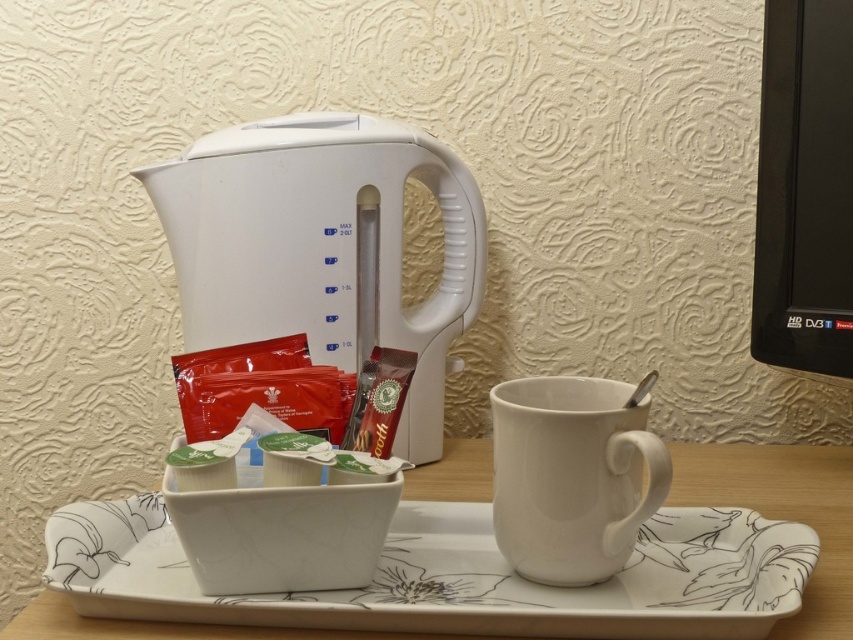
Can you confirm if black plastic monitor at upper right is positioned to the right of white ceramic mug at lower center?

Indeed, black plastic monitor at upper right is positioned on the right side of white ceramic mug at lower center.

Between black plastic monitor at upper right and white ceramic mug at lower center, which one is positioned higher?

black plastic monitor at upper right is higher up.

Find the location of a particular element. The image size is (853, 640). black plastic monitor at upper right is located at coordinates 804,189.

Who is shorter, white plastic kettle at upper center or white ceramic mug at lower center?

white ceramic mug at lower center

This screenshot has width=853, height=640. Find the location of `white plastic kettle at upper center`. white plastic kettle at upper center is located at coordinates (322, 246).

What do you see at coordinates (322, 246) in the screenshot? I see `white plastic kettle at upper center` at bounding box center [322, 246].

The width and height of the screenshot is (853, 640). In order to click on white plastic kettle at upper center in this screenshot , I will do `click(322, 246)`.

Does white plastic kettle at upper center appear on the right side of white ceramic tray at center?

In fact, white plastic kettle at upper center is to the left of white ceramic tray at center.

Can you confirm if white plastic kettle at upper center is positioned to the left of white ceramic tray at center?

Yes, white plastic kettle at upper center is to the left of white ceramic tray at center.

Is point (373, 211) positioned after point (503, 563)?

Yes, it is.

At what (x,y) coordinates should I click in order to perform the action: click on white plastic kettle at upper center. Please return your answer as a coordinate pair (x, y). The height and width of the screenshot is (640, 853). Looking at the image, I should click on (322, 246).